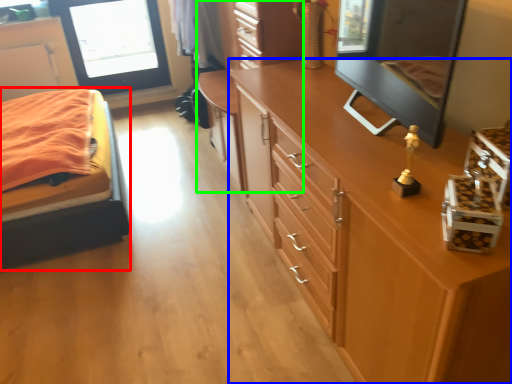
Question: Which object is positioned closest to bed (highlighted by a red box)? Select from chest of drawers (highlighted by a blue box) and dresser (highlighted by a green box).

Choices:
 (A) chest of drawers
 (B) dresser

Answer: (B)